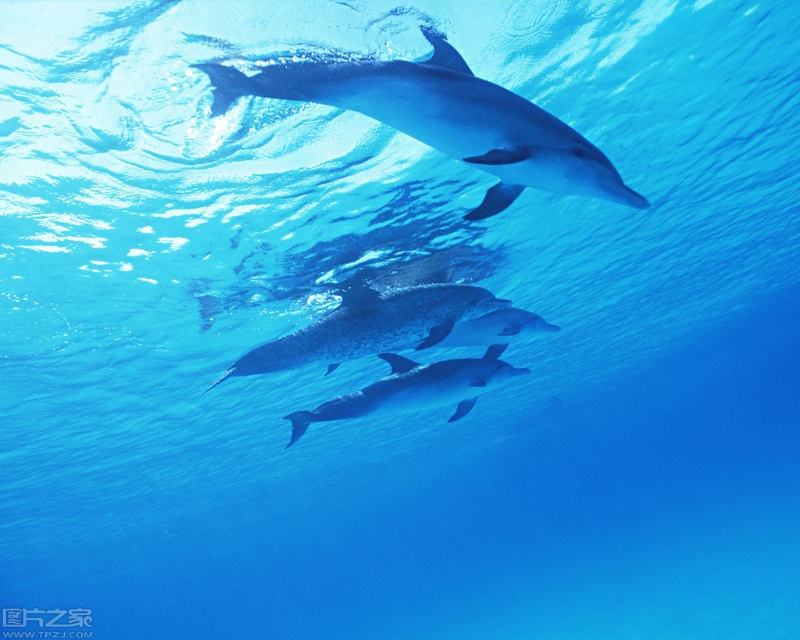
You are a marine biologist observing an underwater scene. You notice a point at coordinates (445, 120). What object is located at this point?

The sleek silver dolphin at upper center is located at point (445, 120).

You are a marine biologist observing the underwater scene. You notice two dolphins, the speckled blue dolphin at center and the glossy blue dolphin at center. Which dolphin has a greater width?

The speckled blue dolphin at center has a greater width than the glossy blue dolphin at center according to the description.

You are a marine biologist observing the underwater scene. You notice two dolphins, the speckled blue dolphin at center and the glossy blue dolphin at center. Which dolphin has a greater height?

The speckled blue dolphin at center is much taller than the glossy blue dolphin at center, so the speckled blue dolphin at center has a greater height.